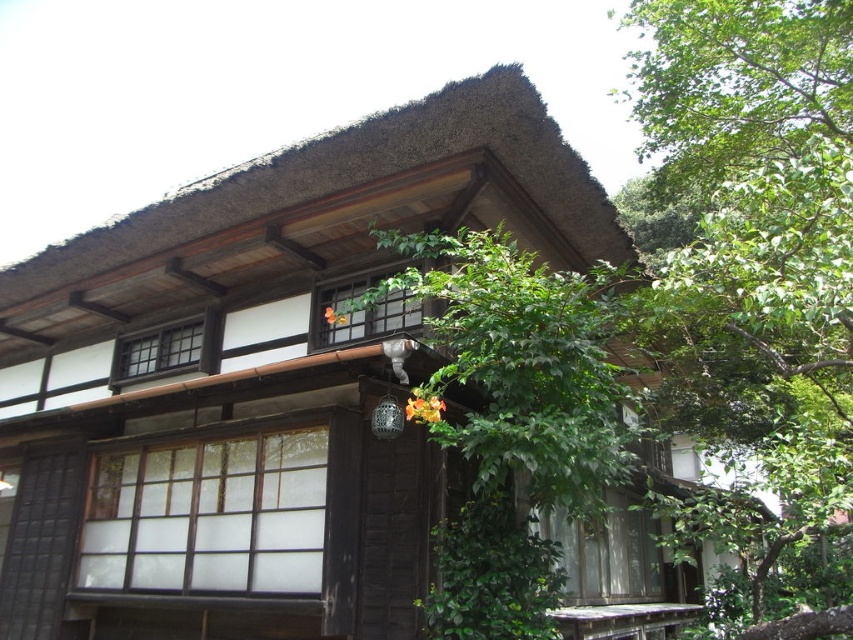
You are a visitor to this traditional Japanese house and want to take a photo of the brown wooden hut at center and the green leafy tree at center. Which object should you focus on first if you want to capture both in a single frame without moving the camera?

The brown wooden hut at center has a larger size compared to the green leafy tree at center, so you should focus on the brown wooden hut at center first to ensure it is fully captured in the frame before adjusting for the smaller tree.

You are standing in front of the traditional Japanese house and want to take a photo. There are two points marked on the house at coordinates point (x=751, y=272) and point (x=509, y=456). Which point is closer to your camera when taking the photo?

Point (x=751, y=272) is closer to the camera than point (x=509, y=456).